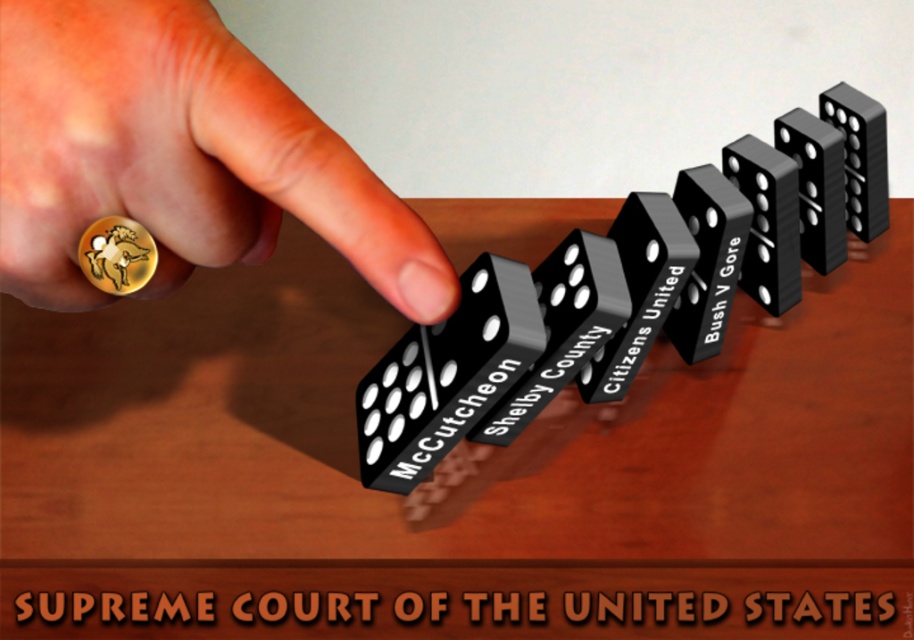
Between wooden table at center and black plastic dominoes at center, which one appears on the left side from the viewer's perspective?

Positioned to the left is wooden table at center.

Is point (480, 204) in front of point (514, 433)?

No, it is behind (514, 433).

Does point (126, 541) come farther from viewer compared to point (683, 220)?

No, it is in front of (683, 220).

This screenshot has height=640, width=914. I want to click on wooden table at center, so (453, 472).

Which is below, gold ring at left or black plastic domino at upper right?

gold ring at left is below.

Does gold ring at left have a smaller size compared to black plastic domino at upper right?

No, gold ring at left is not smaller than black plastic domino at upper right.

Locate an element on the screen. The width and height of the screenshot is (914, 640). gold ring at left is located at coordinates (178, 156).

Identify the location of gold ring at left. Image resolution: width=914 pixels, height=640 pixels. (178, 156).

Which is more to the right, wooden table at center or gold ring at left?

wooden table at center is more to the right.

Is point (109, 355) closer to viewer compared to point (11, 220)?

No, (109, 355) is behind (11, 220).

Where is `wooden table at center`? wooden table at center is located at coordinates (453, 472).